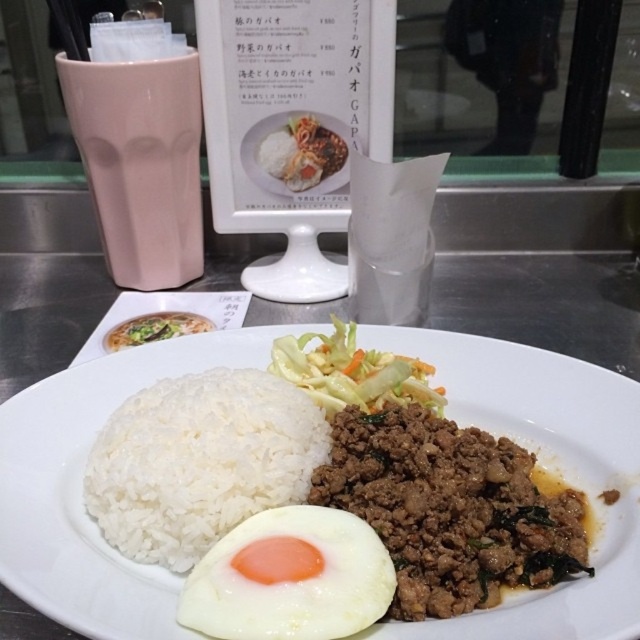
Question: Which of the following is the farthest from the observer?

Choices:
 (A) green leafy vegetable at center
 (B) white matte rice at center
 (C) white fried egg at center

Answer: (A)

Question: Can you confirm if white polished rice at center is bigger than white fried egg at center?

Choices:
 (A) yes
 (B) no

Answer: (A)

Question: Does white fried egg at center appear over green leafy vegetable at center?

Choices:
 (A) yes
 (B) no

Answer: (B)

Question: Based on their relative distances, which object is farther from the white polished rice at center?

Choices:
 (A) white matte rice at center
 (B) green leafy vegetable at center
 (C) white fried egg at center

Answer: (B)

Question: Which point appears farthest from the camera in this image?

Choices:
 (A) (176, 444)
 (B) (305, 506)
 (C) (154, 320)
 (D) (484, 636)

Answer: (C)

Question: Is white matte rice at center thinner than white fried egg at center?

Choices:
 (A) no
 (B) yes

Answer: (A)